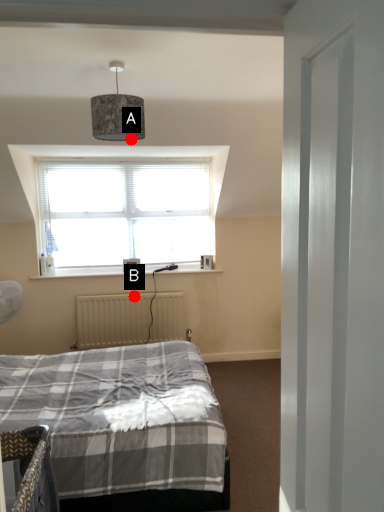
Question: Two points are circled on the image, labeled by A and B beside each circle. Among these points, which one is farthest from the camera?

Choices:
 (A) A is further
 (B) B is further

Answer: (B)